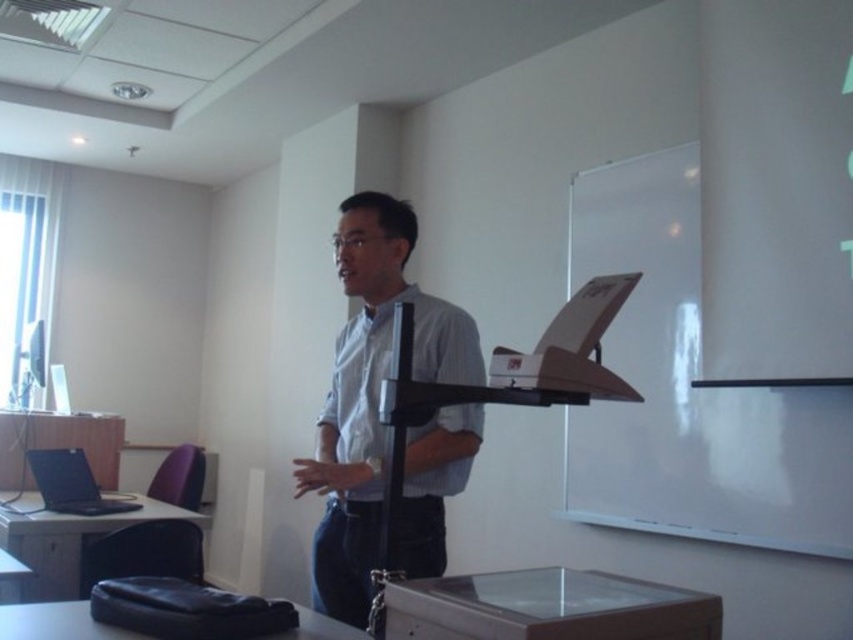
You are a student sitting in the classroom and need to compare the sizes of the white matte board at upper right and the light blue shirt at center. Which one is wider?

The white matte board at upper right is wider than the light blue shirt at center.

Consider the image. You are a student sitting in the back row of the classroom. You want to take a photo of the white matte board at upper right and the light blue shirt at center for your notes. Which object will appear larger in your photo?

The white matte board at upper right will appear larger in your photo because it is much taller than the light blue shirt at center.